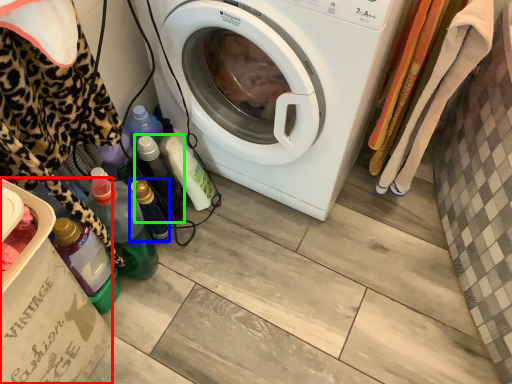
Question: Which object is the closest to the cardboard box (highlighted by a red box)? Choose among these: bottle (highlighted by a blue box) or bottle (highlighted by a green box).

Choices:
 (A) bottle
 (B) bottle

Answer: (A)